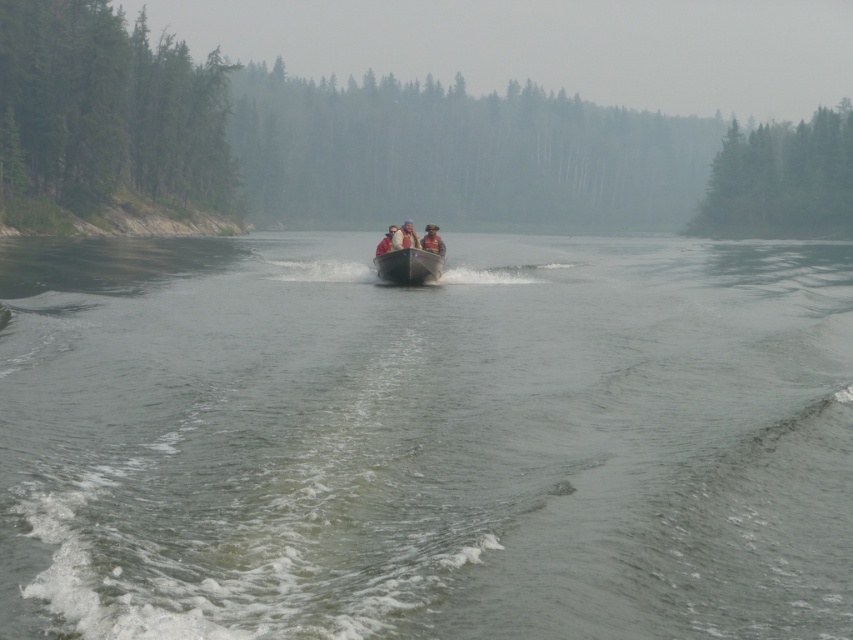
Is clear water at center to the left of matte pink life vest at center from the viewer's perspective?

No, clear water at center is not to the left of matte pink life vest at center.

You are a GUI agent. You are given a task and a screenshot of the screen. Output one action in this format:
    pyautogui.click(x=<x>, y=<y>)
    Task: Click on the clear water at center
    This screenshot has height=640, width=853.
    Given the screenshot: What is the action you would take?
    pyautogui.click(x=425, y=438)

This screenshot has width=853, height=640. Describe the element at coordinates (316, 138) in the screenshot. I see `green matte trees at center` at that location.

Between green matte trees at center and matte pink life vest at center, which one appears on the left side from the viewer's perspective?

green matte trees at center is more to the left.

Between point (300, 131) and point (381, 241), which one is positioned behind?

The point (300, 131) is behind.

Where is `green matte trees at center`? green matte trees at center is located at coordinates (316, 138).

Is green matte trees at center further to camera compared to metallic gray boat at center?

Yes, it is.

Which is in front, point (532, 204) or point (410, 262)?

Point (410, 262)

Locate an element on the screen. The image size is (853, 640). green matte trees at center is located at coordinates (316, 138).